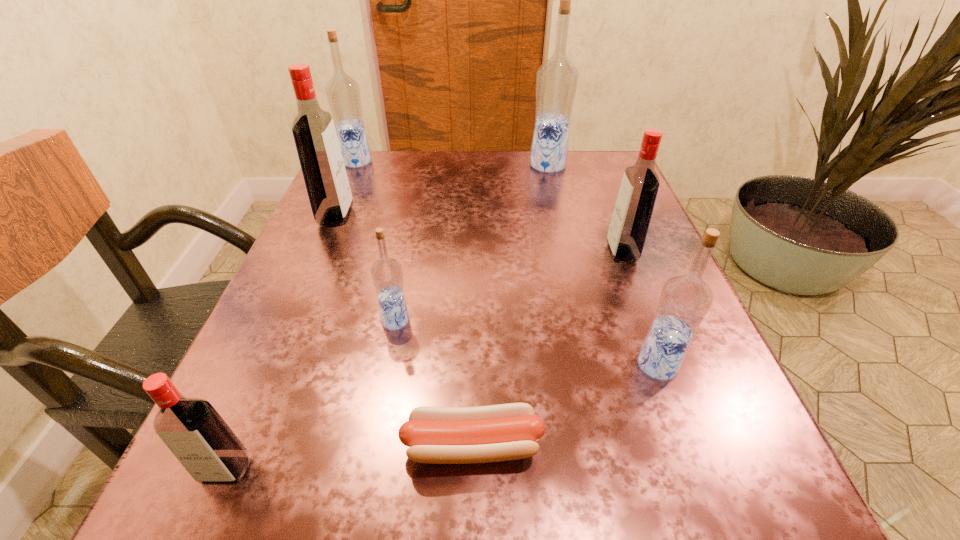
Locate an element on the screen. The height and width of the screenshot is (540, 960). the tallest object is located at coordinates (556, 82).

In order to click on the fifth vodka from left to right in this screenshot , I will do `click(556, 82)`.

The height and width of the screenshot is (540, 960). In order to click on the leftmost blue vodka in this screenshot , I will do `click(343, 93)`.

This screenshot has width=960, height=540. In order to click on the farthest red vodka in this screenshot , I will do `click(313, 129)`.

Find the location of a particular element. Image resolution: width=960 pixels, height=540 pixels. the sixth nearest object is located at coordinates (313, 129).

Find the location of `the fourth farthest object`. the fourth farthest object is located at coordinates (631, 217).

Image resolution: width=960 pixels, height=540 pixels. I want to click on the second biggest red vodka, so click(x=631, y=217).

The image size is (960, 540). What are the coordinates of `the nearest blue vodka` in the screenshot? It's located at (685, 299).

You are a GUI agent. You are given a task and a screenshot of the screen. Output one action in this format:
    pyautogui.click(x=<x>, y=<y>)
    Task: Click on the sixth farthest vodka
    This screenshot has height=540, width=960.
    Given the screenshot: What is the action you would take?
    pyautogui.click(x=685, y=299)

The width and height of the screenshot is (960, 540). I want to click on the nearest red vodka, so click(192, 429).